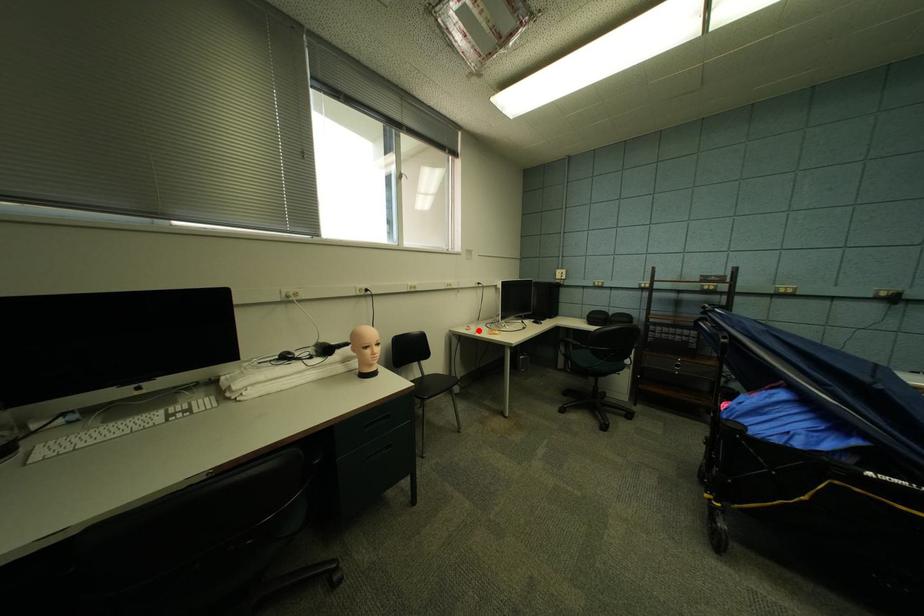
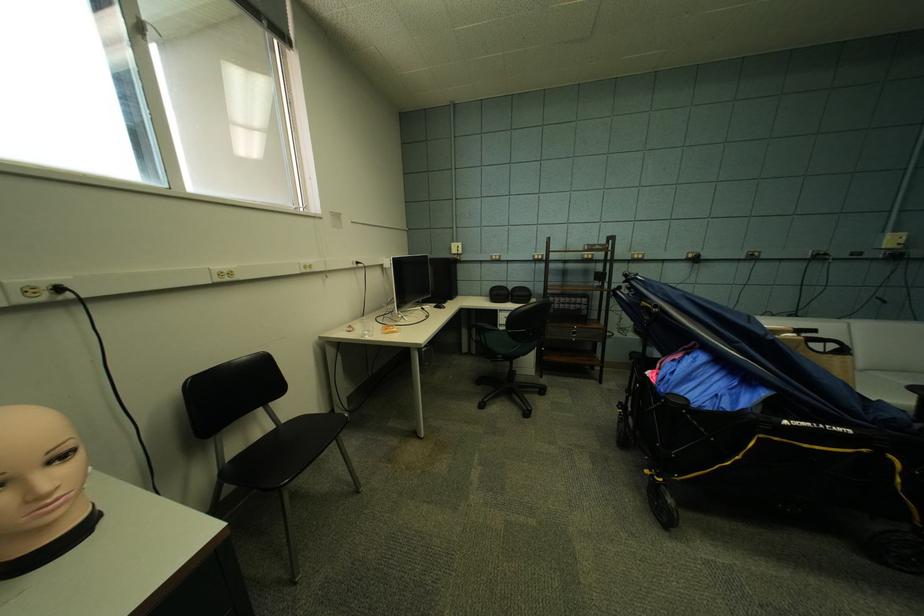
Locate, in the second image, the point that corresponds to the highlighted location in the first image.

(361, 331)